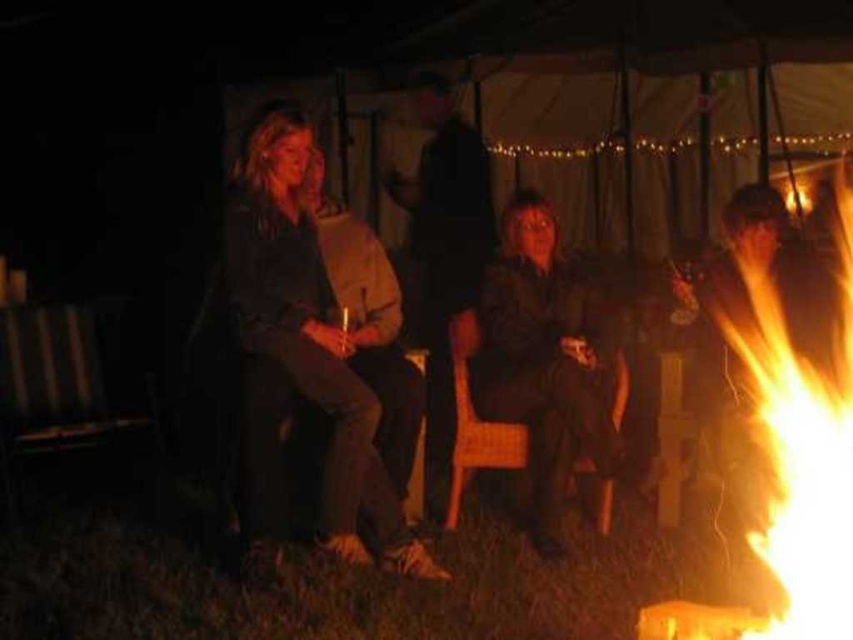
Question: Can you confirm if wooden slats chair at left is wider than wooden chair at center?

Choices:
 (A) yes
 (B) no

Answer: (A)

Question: Which of the following is the farthest from the observer?

Choices:
 (A) dark brown leather jacket at center
 (B) wooden chair at center
 (C) flamematerial/texture at right

Answer: (A)

Question: Which is nearer to the dark brown leather jacket at left?

Choices:
 (A) flamematerial/texture at right
 (B) matte brown jacket at center

Answer: (B)

Question: Is dark brown leather jacket at left closer to camera compared to wooden chair at center?

Choices:
 (A) no
 (B) yes

Answer: (B)

Question: Which of these objects is positioned farthest from the matte brown jacket at center?

Choices:
 (A) dark brown leather jacket at left
 (B) flamematerial/texture at right
 (C) wooden chair at center

Answer: (B)

Question: Can you confirm if dark brown leather jacket at center is wider than wooden chair at center?

Choices:
 (A) no
 (B) yes

Answer: (B)